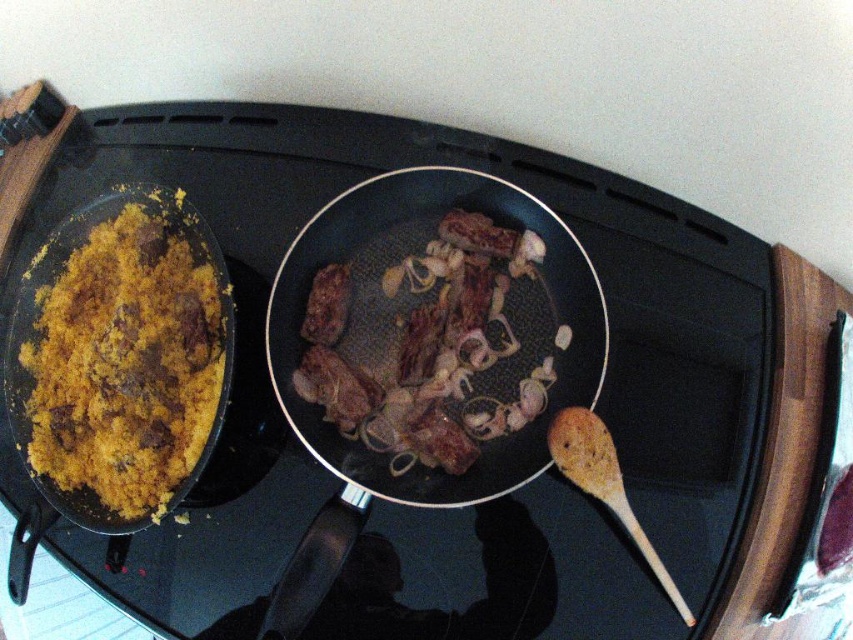
Question: Based on their relative distances, which object is nearer to the brown matte meat at center?

Choices:
 (A) wooden spoon at lower right
 (B) yellow rice at left

Answer: (A)

Question: Is yellow rice at left behind brown matte meat at center?

Choices:
 (A) no
 (B) yes

Answer: (A)

Question: Which point is closer to the camera?

Choices:
 (A) brown matte meat at center
 (B) yellow rice at left
 (C) wooden spoon at lower right
 (D) shiny black wok at center

Answer: (D)

Question: Can you confirm if yellow rice at left is thinner than wooden spoon at lower right?

Choices:
 (A) yes
 (B) no

Answer: (B)

Question: Which object is the closest to the shiny black wok at center?

Choices:
 (A) brown matte meat at center
 (B) wooden spoon at lower right
 (C) yellow rice at left

Answer: (A)

Question: Does brown matte meat at center come behind wooden spoon at lower right?

Choices:
 (A) no
 (B) yes

Answer: (B)